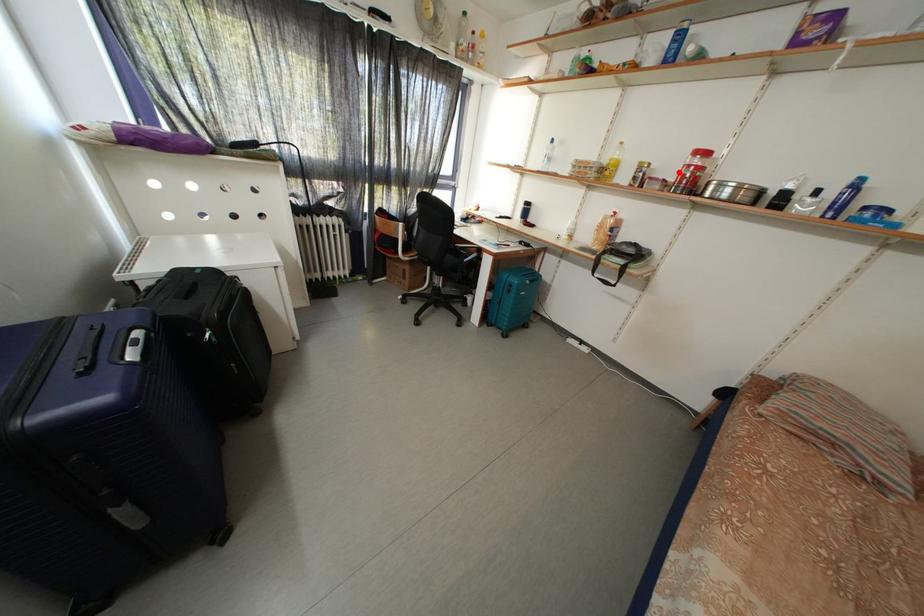
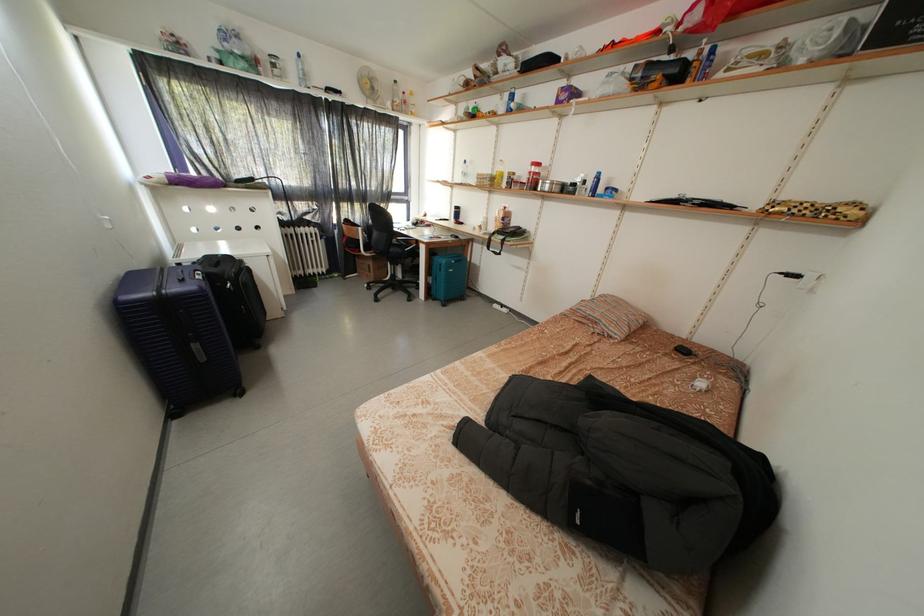
Where in the second image is the point corresponding to the highlighted location from the first image?

(530, 180)